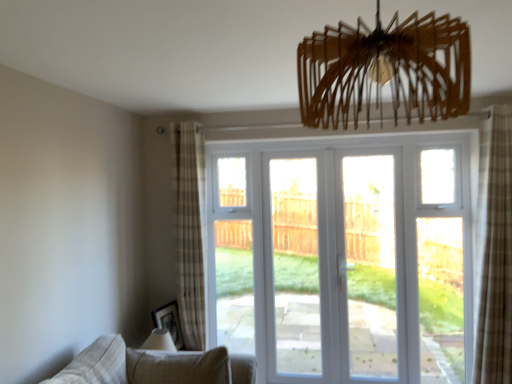
Question: Should I look upward or downward to see matte black picture frame at lower left?

Choices:
 (A) down
 (B) up

Answer: (A)

Question: Is beige fabric couch at lower left shorter than wooden chandelier at upper center?

Choices:
 (A) yes
 (B) no

Answer: (A)

Question: Is wooden chandelier at upper center a part of beige fabric couch at lower left?

Choices:
 (A) no
 (B) yes

Answer: (A)

Question: Can you confirm if beige fabric couch at lower left is positioned to the left of wooden chandelier at upper center?

Choices:
 (A) yes
 (B) no

Answer: (A)

Question: Is beige fabric couch at lower left outside of wooden chandelier at upper center?

Choices:
 (A) yes
 (B) no

Answer: (A)

Question: Is beige fabric couch at lower left far from wooden chandelier at upper center?

Choices:
 (A) no
 (B) yes

Answer: (B)

Question: Can you confirm if beige fabric couch at lower left is taller than wooden chandelier at upper center?

Choices:
 (A) yes
 (B) no

Answer: (B)

Question: Can white glossy door at center, the first screen door from the right, be found inside beige fabric couch at lower left?

Choices:
 (A) yes
 (B) no

Answer: (B)

Question: From a real-world perspective, is beige fabric couch at lower left on top of white glossy door at center, the first screen door from the right?

Choices:
 (A) no
 (B) yes

Answer: (A)

Question: Is beige fabric couch at lower left placed right next to white glossy door at center, which is the second screen door in left-to-right order?

Choices:
 (A) no
 (B) yes

Answer: (A)

Question: Is beige fabric couch at lower left not within white glossy door at center, the first screen door from the right?

Choices:
 (A) no
 (B) yes

Answer: (B)

Question: Is there a large distance between beige fabric couch at lower left and white glossy door at center, the first screen door from the right?

Choices:
 (A) no
 (B) yes

Answer: (B)

Question: From the image's perspective, does beige fabric couch at lower left appear lower than white glossy door at center, the first screen door from the right?

Choices:
 (A) yes
 (B) no

Answer: (A)

Question: Is beige fabric couch at lower left beside matte black picture frame at lower left?

Choices:
 (A) yes
 (B) no

Answer: (B)